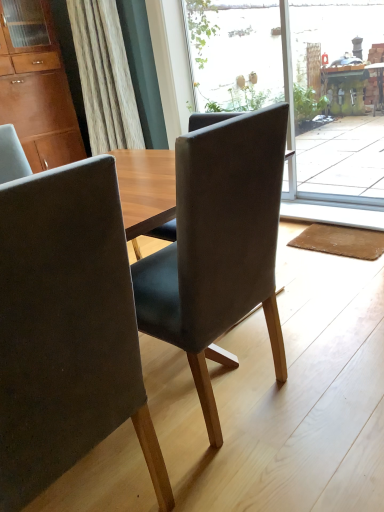
I want to click on free space in front of brown fabric mat at lower right, so click(x=340, y=273).